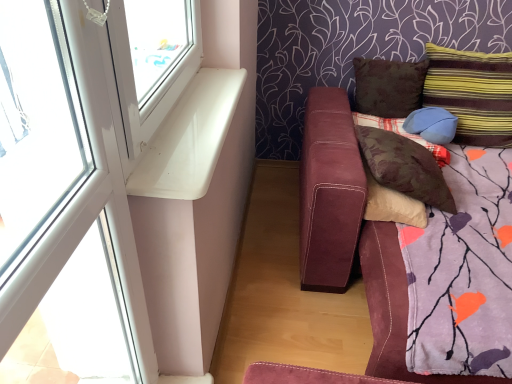
Question: Can you confirm if striped fabric pillow at upper right, which ranks as the 5th pillow in left-to-right order, is bigger than white plastic window at upper left?

Choices:
 (A) no
 (B) yes

Answer: (B)

Question: From a real-world perspective, is striped fabric pillow at upper right, the first pillow from the right, on white plastic window at upper left?

Choices:
 (A) yes
 (B) no

Answer: (B)

Question: Can you confirm if striped fabric pillow at upper right, which ranks as the 5th pillow in left-to-right order, is taller than white plastic window at upper left?

Choices:
 (A) no
 (B) yes

Answer: (A)

Question: Does striped fabric pillow at upper right, the first pillow from the right, contain white plastic window at upper left?

Choices:
 (A) no
 (B) yes

Answer: (A)

Question: Is the depth of striped fabric pillow at upper right, which ranks as the 5th pillow in left-to-right order, less than that of white plastic window at upper left?

Choices:
 (A) no
 (B) yes

Answer: (A)

Question: Considering the positions of brown fabric pillow at center, the 1th pillow viewed from the left, and blue fabric pillow at right, acting as the third pillow starting from the right, in the image, is brown fabric pillow at center, the 1th pillow viewed from the left, wider or thinner than blue fabric pillow at right, acting as the third pillow starting from the right,?

Choices:
 (A) wide
 (B) thin

Answer: (A)

Question: From their relative heights in the image, would you say brown fabric pillow at center, which is the 5th pillow from right to left, is taller or shorter than blue fabric pillow at right, acting as the third pillow starting from the right?

Choices:
 (A) tall
 (B) short

Answer: (A)

Question: Considering the relative positions of brown fabric pillow at center, which is the 5th pillow from right to left, and blue fabric pillow at right, which ranks as the 3th pillow in left-to-right order, in the image provided, is brown fabric pillow at center, which is the 5th pillow from right to left, to the left or to the right of blue fabric pillow at right, which ranks as the 3th pillow in left-to-right order,?

Choices:
 (A) left
 (B) right

Answer: (A)

Question: Is brown fabric pillow at center, which is the 5th pillow from right to left, situated inside blue fabric pillow at right, which ranks as the 3th pillow in left-to-right order, or outside?

Choices:
 (A) inside
 (B) outside

Answer: (B)

Question: Is white glossy window sill at upper left inside the boundaries of striped fabric pillow at upper right, the first pillow from the right, or outside?

Choices:
 (A) inside
 (B) outside

Answer: (B)

Question: Is white glossy window sill at upper left taller or shorter than striped fabric pillow at upper right, the first pillow from the right?

Choices:
 (A) tall
 (B) short

Answer: (B)

Question: Relative to striped fabric pillow at upper right, the first pillow from the right, is white glossy window sill at upper left in front or behind?

Choices:
 (A) front
 (B) behind

Answer: (A)

Question: Considering the relative positions of white glossy window sill at upper left and striped fabric pillow at upper right, which ranks as the 5th pillow in left-to-right order, in the image provided, is white glossy window sill at upper left to the left or to the right of striped fabric pillow at upper right, which ranks as the 5th pillow in left-to-right order,?

Choices:
 (A) left
 (B) right

Answer: (A)

Question: From a real-world perspective, relative to matte blue pillow at upper right, the 4th pillow when ordered from left to right, is white glossy window sill at upper left vertically above or below?

Choices:
 (A) above
 (B) below

Answer: (A)

Question: Looking at their shapes, would you say white glossy window sill at upper left is wider or thinner than matte blue pillow at upper right, which ranks as the 2th pillow in right-to-left order?

Choices:
 (A) wide
 (B) thin

Answer: (B)